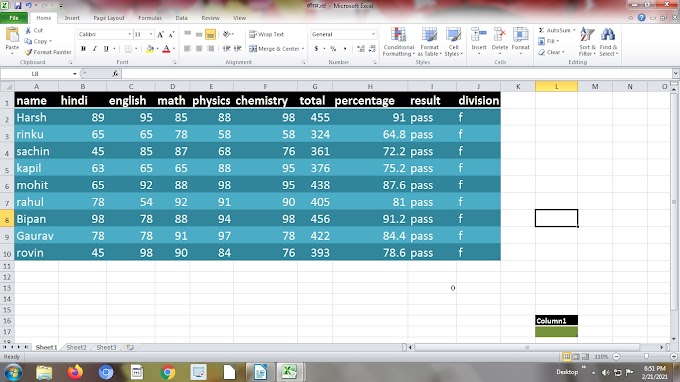
The height and width of the screenshot is (382, 680). Find the location of `light blue rows on table`. light blue rows on table is located at coordinates (71, 238), (66, 203), (65, 166), (73, 134).